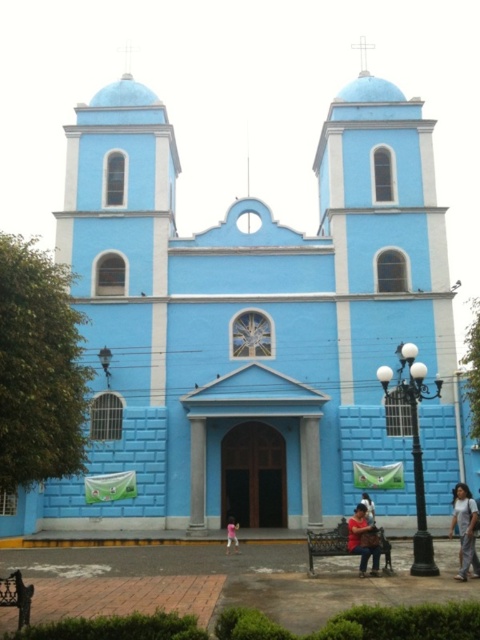
Question: Does matte black jacket at center appear over pink fabric at center?

Choices:
 (A) no
 (B) yes

Answer: (B)

Question: Which of the following is the farthest from the observer?

Choices:
 (A) denim pants at lower right
 (B) matte black jacket at center
 (C) pink fabric at center
 (D) light brown leather jacket at lower center

Answer: (C)

Question: Does denim pants at lower right appear over light brown leather jacket at lower center?

Choices:
 (A) no
 (B) yes

Answer: (A)

Question: Which object is farther from the camera taking this photo?

Choices:
 (A) pink fabric at center
 (B) matte black jacket at center

Answer: (A)

Question: Is denim pants at lower right closer to camera compared to pink fabric at center?

Choices:
 (A) yes
 (B) no

Answer: (A)

Question: Which object appears closest to the camera in this image?

Choices:
 (A) denim pants at lower right
 (B) pink fabric at center
 (C) matte black jacket at center
 (D) light brown leather jacket at lower center

Answer: (A)